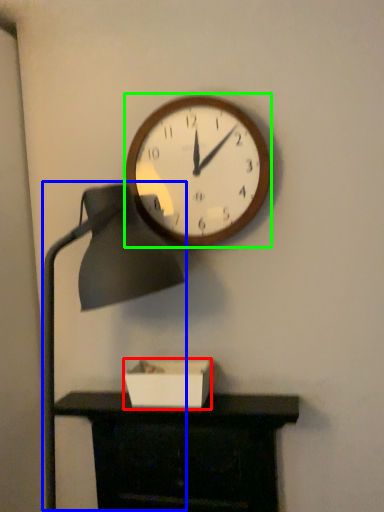
Question: Estimate the real-world distances between objects in this image. Which object is closer to box (highlighted by a red box), table lamp (highlighted by a blue box) or wall clock (highlighted by a green box)?

Choices:
 (A) table lamp
 (B) wall clock

Answer: (A)